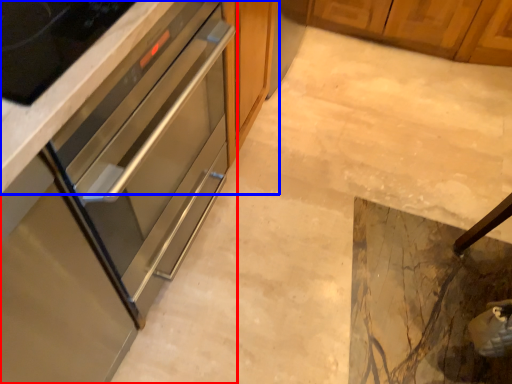
Question: Among these objects, which one is farthest to the camera, cabinetry (highlighted by a red box) or cabinetry (highlighted by a blue box)?

Choices:
 (A) cabinetry
 (B) cabinetry

Answer: (B)